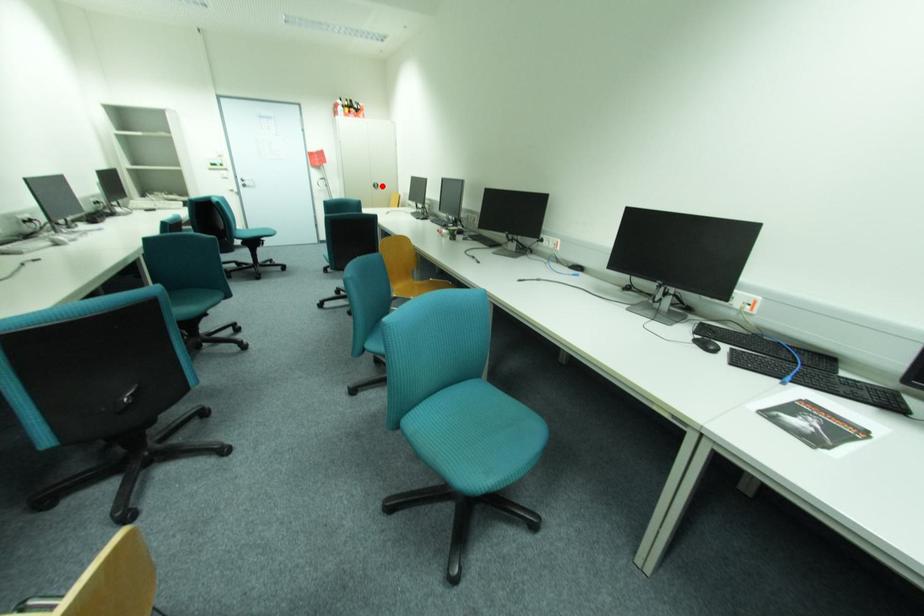
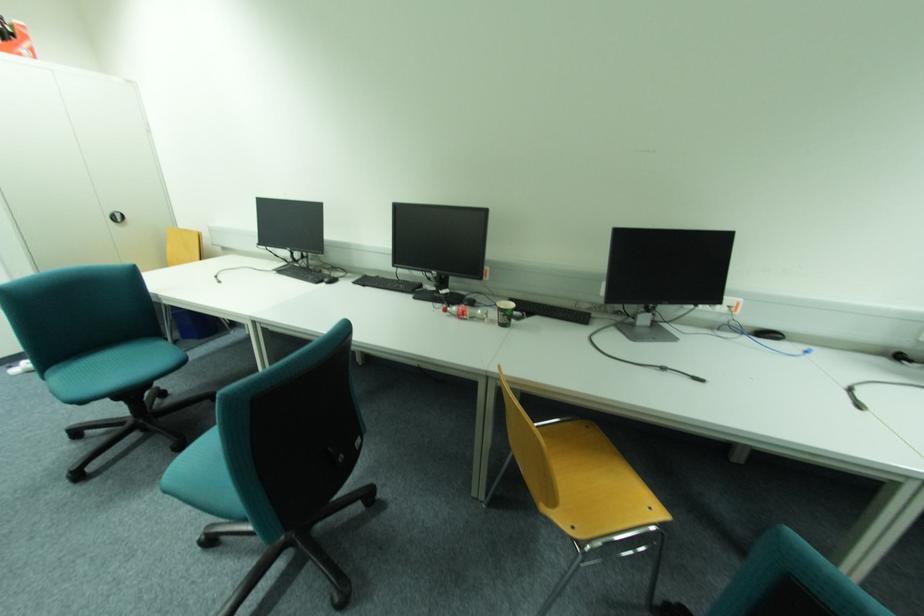
Question: A red point is marked in image1. In image2, is the corresponding 3D point closer to the camera or farther? Reply with the corresponding letter.

Choices:
 (A) The corresponding 3D point is closer.
 (B) The corresponding 3D point is farther.

Answer: (B)